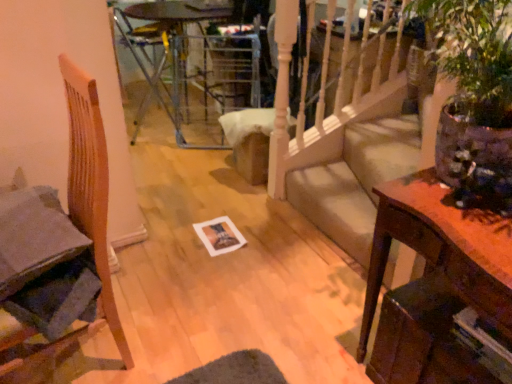
Locate an element on the screen. Image resolution: width=512 pixels, height=384 pixels. spots to the right of wooden chair at left is located at coordinates (188, 335).